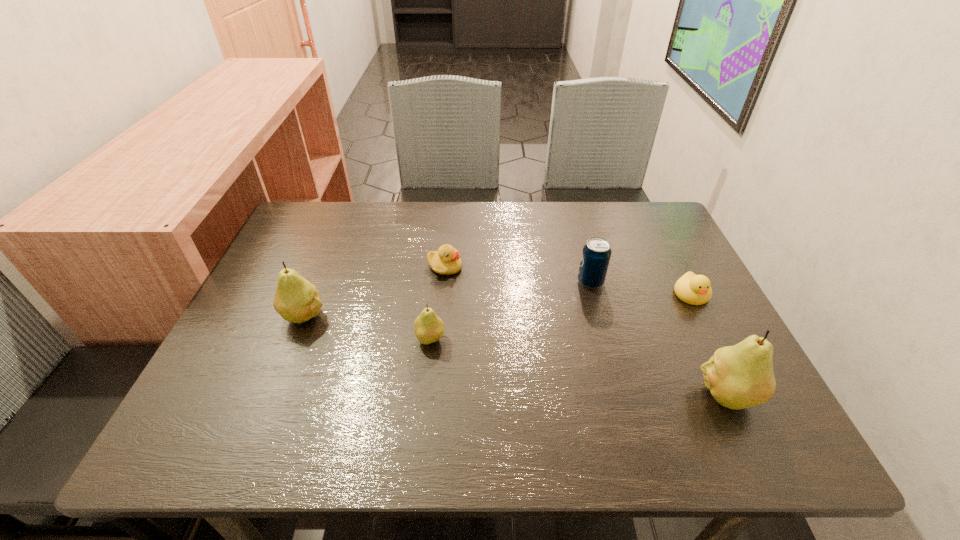
Image resolution: width=960 pixels, height=540 pixels. What are the coordinates of `vacant region that satisfies the following two spatial constraints: 1. on the front side of the nearest pear; 2. on the left side of the second pear from right to left` in the screenshot? It's located at (424, 394).

At what (x,y) coordinates should I click in order to perform the action: click on vacant space that satisfies the following two spatial constraints: 1. on the front-facing side of the soda can; 2. on the right side of the farther duckling. Please return your answer as a coordinate pair (x, y). Looking at the image, I should click on (444, 282).